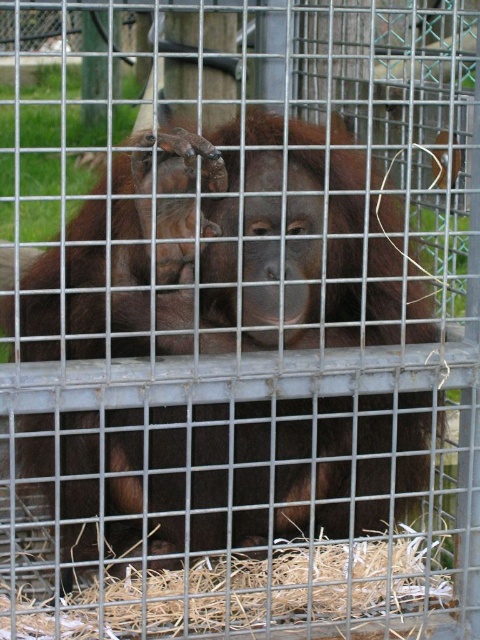
Between brown furry orangutan at center and straw at lower center, which one is positioned lower?

straw at lower center is lower down.

Is brown furry orangutan at center further to camera compared to straw at lower center?

No, brown furry orangutan at center is closer to the viewer.

Is point (154, 486) in front of point (192, 580)?

No, it is behind (192, 580).

Identify the location of brown furry orangutan at center. The width and height of the screenshot is (480, 640). (228, 252).